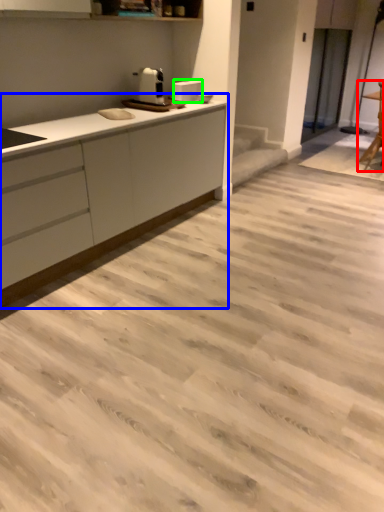
Question: Considering the real-world distances, which object is farthest from chair (highlighted by a red box)? countertop (highlighted by a blue box) or appliance (highlighted by a green box)?

Choices:
 (A) countertop
 (B) appliance

Answer: (A)